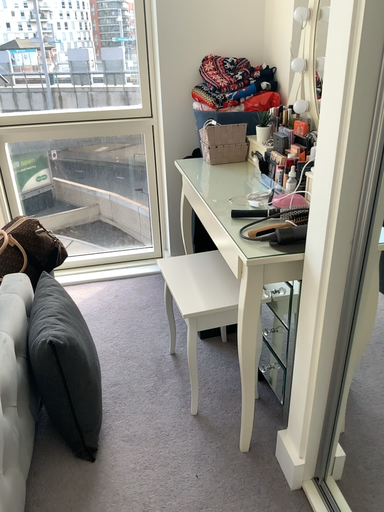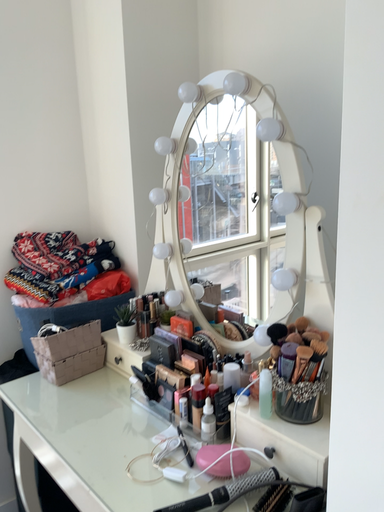
Question: How did the camera likely rotate when shooting the video?

Choices:
 (A) rotated upward
 (B) rotated downward

Answer: (A)